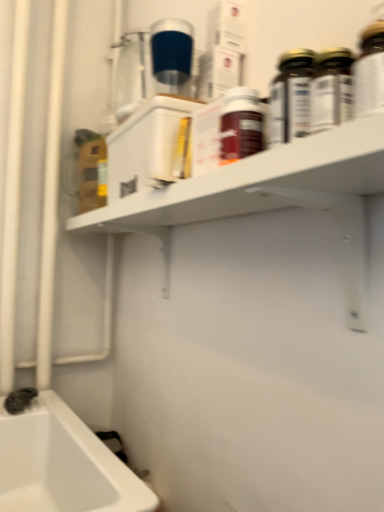
Question: From a real-world perspective, is matte brown bottle at center, which is the second bottle in back-to-front order, over white matte shelf at upper center?

Choices:
 (A) no
 (B) yes

Answer: (B)

Question: Considering the relative sizes of matte brown bottle at center, which ranks as the first bottle in front-to-back order, and white matte shelf at upper center in the image provided, is matte brown bottle at center, which ranks as the first bottle in front-to-back order, thinner than white matte shelf at upper center?

Choices:
 (A) no
 (B) yes

Answer: (B)

Question: Is matte brown bottle at center, the 2th bottle when ordered from right to left, facing away from white matte shelf at upper center?

Choices:
 (A) no
 (B) yes

Answer: (A)

Question: Is matte brown bottle at center, which is the second bottle in back-to-front order, bigger than white matte shelf at upper center?

Choices:
 (A) yes
 (B) no

Answer: (B)

Question: Is matte brown bottle at center, which is the first bottle in bottom-to-top order, positioned before white matte shelf at upper center?

Choices:
 (A) yes
 (B) no

Answer: (B)

Question: Considering the relative sizes of matte brown bottle at center, acting as the 2th bottle starting from the top, and white matte shelf at upper center in the image provided, is matte brown bottle at center, acting as the 2th bottle starting from the top, shorter than white matte shelf at upper center?

Choices:
 (A) yes
 (B) no

Answer: (A)

Question: Does black rubber faucet at lower left have a larger size compared to white matte shelf at upper center?

Choices:
 (A) no
 (B) yes

Answer: (A)

Question: Does black rubber faucet at lower left have a greater width compared to white matte shelf at upper center?

Choices:
 (A) no
 (B) yes

Answer: (A)

Question: From the image's perspective, does black rubber faucet at lower left appear lower than white matte shelf at upper center?

Choices:
 (A) no
 (B) yes

Answer: (B)

Question: Is black rubber faucet at lower left positioned in front of white matte shelf at upper center?

Choices:
 (A) no
 (B) yes

Answer: (A)

Question: From a real-world perspective, does black rubber faucet at lower left stand above white matte shelf at upper center?

Choices:
 (A) yes
 (B) no

Answer: (B)

Question: Is black rubber faucet at lower left shorter than white matte shelf at upper center?

Choices:
 (A) yes
 (B) no

Answer: (A)

Question: Is black rubber faucet at lower left outside of gold metallic bottle at upper right, arranged as the first bottle when viewed from the top?

Choices:
 (A) yes
 (B) no

Answer: (A)